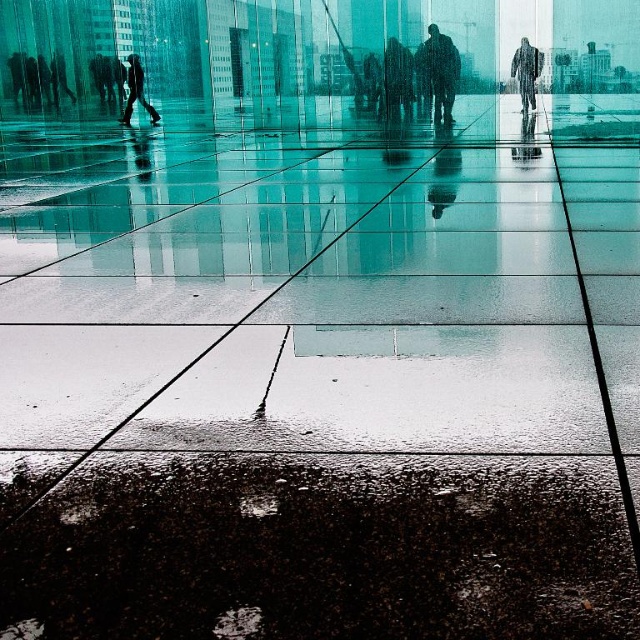
Does raincoat textured coat at upper right have a lesser width compared to dark gray fabric person at upper left?

Yes.

Which is below, raincoat textured coat at upper right or dark gray fabric person at upper left?

raincoat textured coat at upper right

What do you see at coordinates (525, 72) in the screenshot?
I see `raincoat textured coat at upper right` at bounding box center [525, 72].

At what (x,y) coordinates should I click in order to perform the action: click on raincoat textured coat at upper right. Please return your answer as a coordinate pair (x, y). Looking at the image, I should click on (525, 72).

Consider the image. Does matte black jacket at center have a lesser width compared to raincoat textured coat at upper right?

Incorrect, matte black jacket at center's width is not less than raincoat textured coat at upper right's.

Who is lower down, matte black jacket at center or raincoat textured coat at upper right?

raincoat textured coat at upper right is lower down.

Identify the location of matte black jacket at center. (397, 80).

The width and height of the screenshot is (640, 640). Identify the location of matte black jacket at center. pyautogui.click(x=397, y=80).

Can you confirm if silhouette raincoat at center is positioned below dark gray fabric person at upper left?

Yes.

Which is above, silhouette raincoat at center or dark gray fabric person at upper left?

dark gray fabric person at upper left is above.

Is point (454, 65) closer to viewer compared to point (138, 88)?

That is True.

This screenshot has width=640, height=640. In order to click on silhouette raincoat at center in this screenshot , I will do `click(442, 72)`.